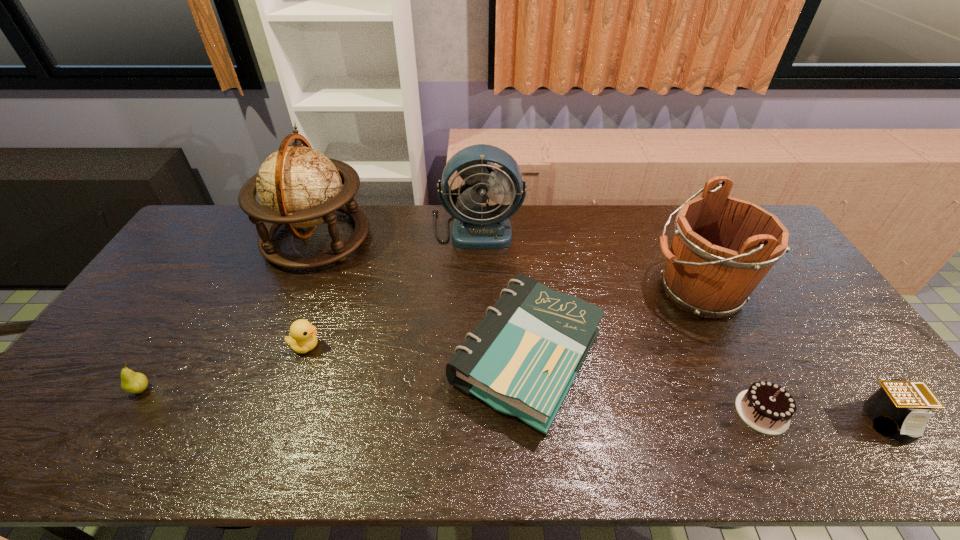
Identify the location of globe. The width and height of the screenshot is (960, 540). (298, 186).

Image resolution: width=960 pixels, height=540 pixels. Find the location of `fan`. fan is located at coordinates (475, 227).

This screenshot has width=960, height=540. What are the coordinates of `bucket` in the screenshot? It's located at (722, 248).

This screenshot has height=540, width=960. In order to click on paperback book in this screenshot , I will do `click(522, 358)`.

Identify the location of the leftmost object. The height and width of the screenshot is (540, 960). (132, 382).

Find the location of a particular element. The image size is (960, 540). duck is located at coordinates (302, 339).

You are a GUI agent. You are given a task and a screenshot of the screen. Output one action in this format:
    pyautogui.click(x=<x>, y=<y>)
    Task: Click on the chocolate cake
    
    Given the screenshot: What is the action you would take?
    pyautogui.click(x=766, y=407)

Where is `the rightmost object`? the rightmost object is located at coordinates (899, 408).

I want to click on free space located 0.080m on the left of the globe, so click(241, 238).

Locate an element on the screen. The image size is (960, 540). vacant area located 0.400m in front of the fan to blow air is located at coordinates (475, 343).